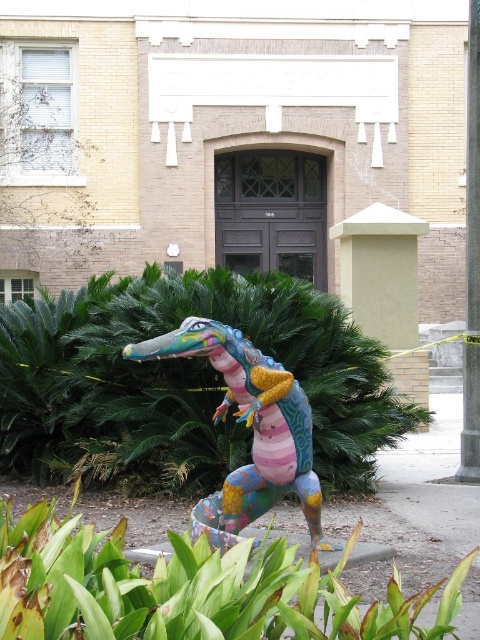
You are a gardener trying to place a new decorative item between the green leafy plant at lower center and the smooth gray pole at right. Which object should you move closer to the other to create space?

Since the green leafy plant at lower center is wider than the smooth gray pole at right, you should move the smooth gray pole at right closer to the plant to create space between them.

You are standing in front of the sculpture and want to place a small bench. The bench requires a clear space of 1 meter in front of it. Given the green leafy plant at lower center is at point 0.920, 0.398, can you place the bench there?

The green leafy plant at lower center is located at point (191, 588), so placing the bench there would not leave enough space as the plant is already occupying that area. Choose another spot.

You are a gardener who wants to water the green leafy plant at center and the multicolored painted crocodile at center. Which one should you water first if you want to start from the left side?

The green leafy plant at center should be watered first because it is positioned on the left side of the multicolored painted crocodile at center.